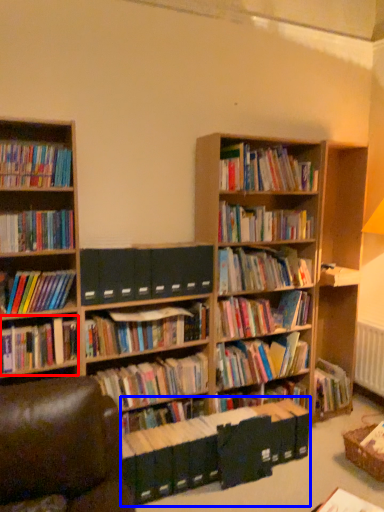
Question: Which object is closer to the camera taking this photo, book (highlighted by a red box) or book (highlighted by a blue box)?

Choices:
 (A) book
 (B) book

Answer: (B)